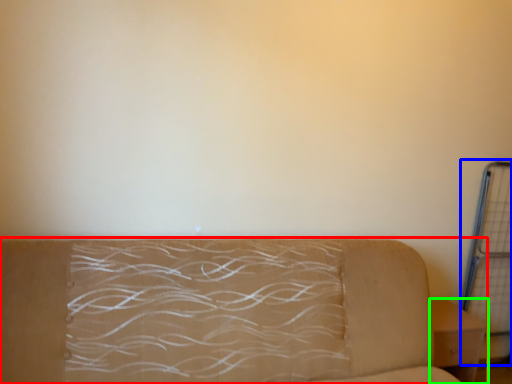
Question: Estimate the real-world distances between objects in this image. Which object is farther from studio couch (highlighted by a red box), cage (highlighted by a blue box) or furniture (highlighted by a green box)?

Choices:
 (A) cage
 (B) furniture

Answer: (A)